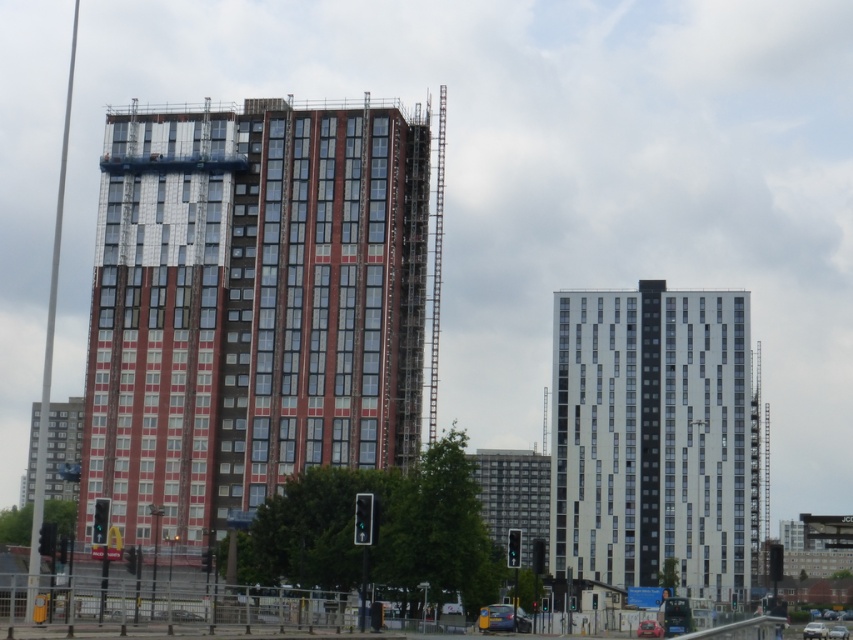
Does red brick building at center have a lesser height compared to white glass building at center?

Correct, red brick building at center is not as tall as white glass building at center.

Does red brick building at center appear under white glass building at center?

Actually, red brick building at center is above white glass building at center.

Find the location of `red brick building at center`. red brick building at center is located at coordinates (251, 305).